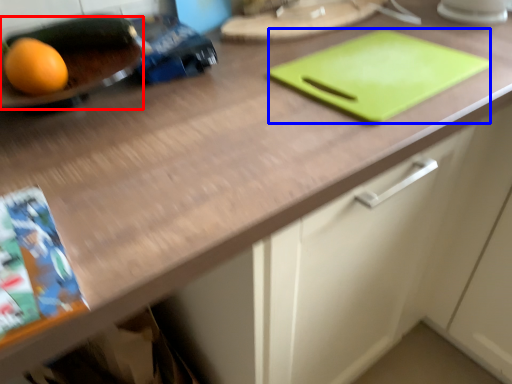
Question: Which object appears closest to the camera in this image, tray (highlighted by a red box) or tray (highlighted by a blue box)?

Choices:
 (A) tray
 (B) tray

Answer: (A)